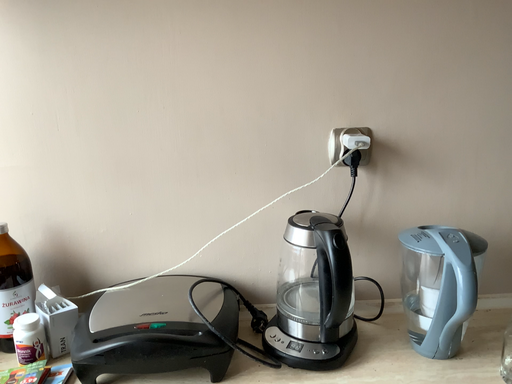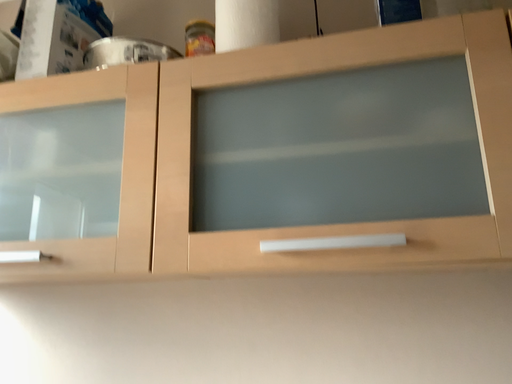
Question: How did the camera likely rotate when shooting the video?

Choices:
 (A) rotated upward
 (B) rotated downward

Answer: (A)